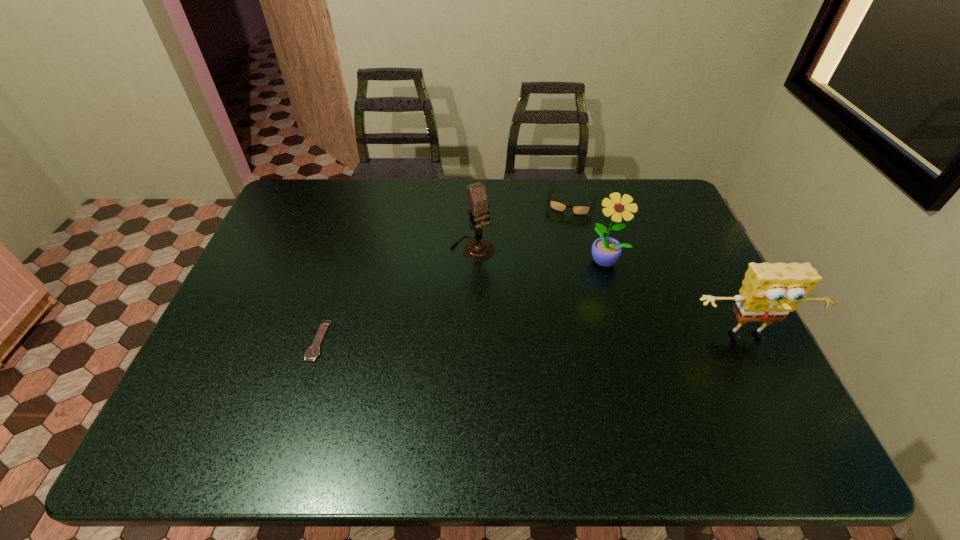
The image size is (960, 540). Find the location of `vacant space on the desktop that is between the leftmost object and the sponge and is positioned on the front-facing side of the fourth object from right to left`. vacant space on the desktop that is between the leftmost object and the sponge and is positioned on the front-facing side of the fourth object from right to left is located at coordinates (545, 340).

Where is `free spot on the desktop that is between the leftmost object and the sponge and is positioned on the front-facing side of the fourth tallest object`? This screenshot has width=960, height=540. free spot on the desktop that is between the leftmost object and the sponge and is positioned on the front-facing side of the fourth tallest object is located at coordinates (539, 340).

Where is `free space on the desktop that is between the watch and the rightmost object and is positioned on the front-facing side of the sunflower`? free space on the desktop that is between the watch and the rightmost object and is positioned on the front-facing side of the sunflower is located at coordinates (579, 340).